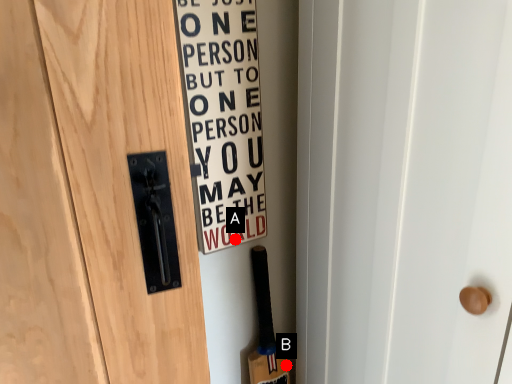
Question: Two points are circled on the image, labeled by A and B beside each circle. Which point is farther from the camera taking this photo?

Choices:
 (A) A is further
 (B) B is further

Answer: (B)